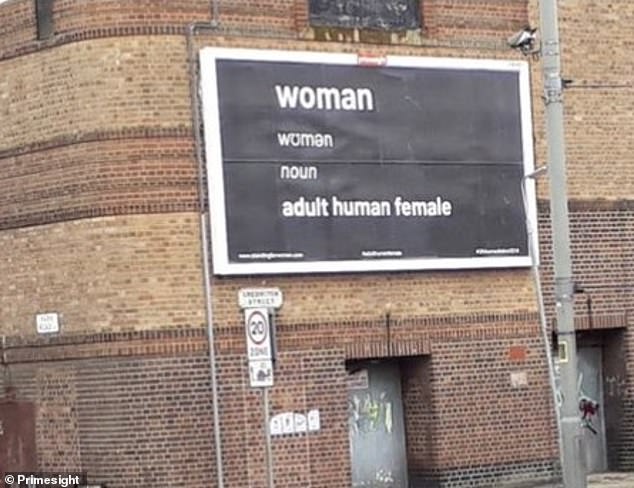
Locate an element on the screen. door is located at coordinates (390, 432), (593, 383).